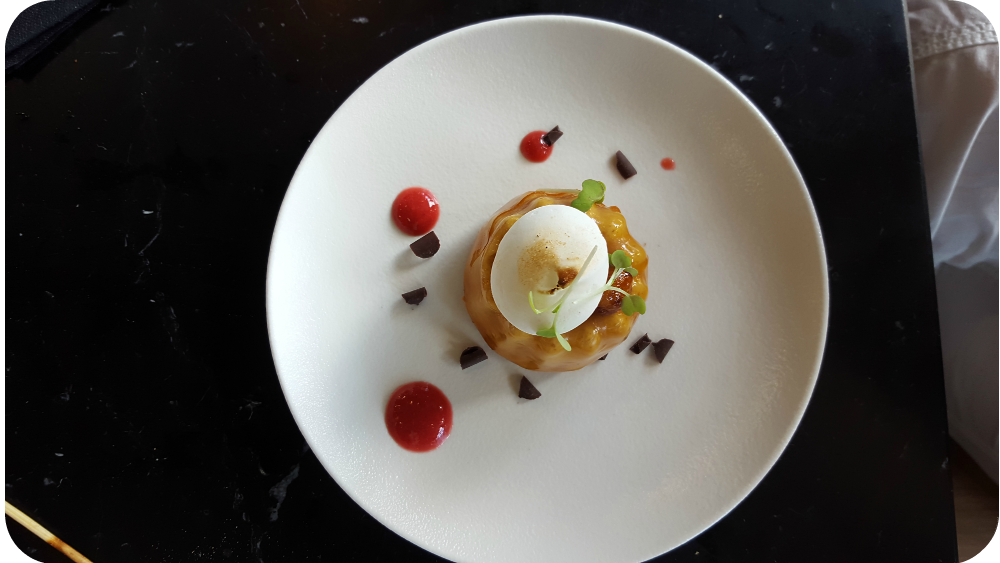
This screenshot has height=563, width=1000. I want to click on top of plate, so click(x=543, y=58).